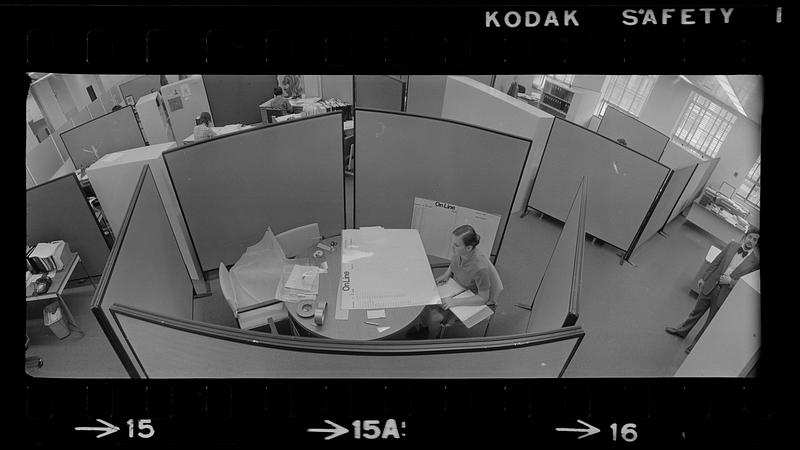
Locate an element on the screen. Image resolution: width=800 pixels, height=450 pixels. carpert is located at coordinates click(636, 290).